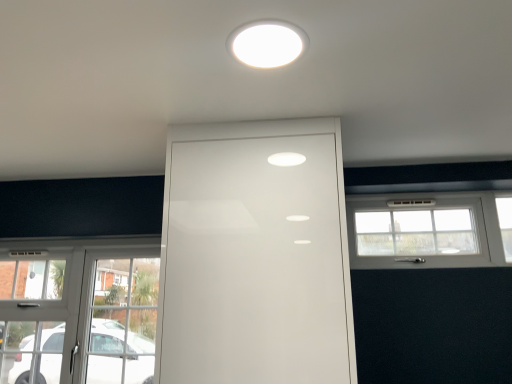
Question: From a real-world perspective, relative to white glossy light fixture at upper center, is white glossy door at center vertically above or below?

Choices:
 (A) above
 (B) below

Answer: (B)

Question: In the image, is white glossy door at center positioned in front of or behind white glossy light fixture at upper center?

Choices:
 (A) front
 (B) behind

Answer: (B)

Question: Which of these objects is positioned closest to the white plastic window at right, the first window from the right?

Choices:
 (A) white glossy door at center
 (B) white glossy light fixture at upper center
 (C) clear glass door at lower left, the 1th window positioned from the bottom

Answer: (A)

Question: Which is nearer to the white glossy light fixture at upper center?

Choices:
 (A) white plastic window at right, which is counted as the 2th window, starting from the left
 (B) clear glass door at lower left, the 1th window positioned from the bottom
 (C) white glossy door at center

Answer: (C)